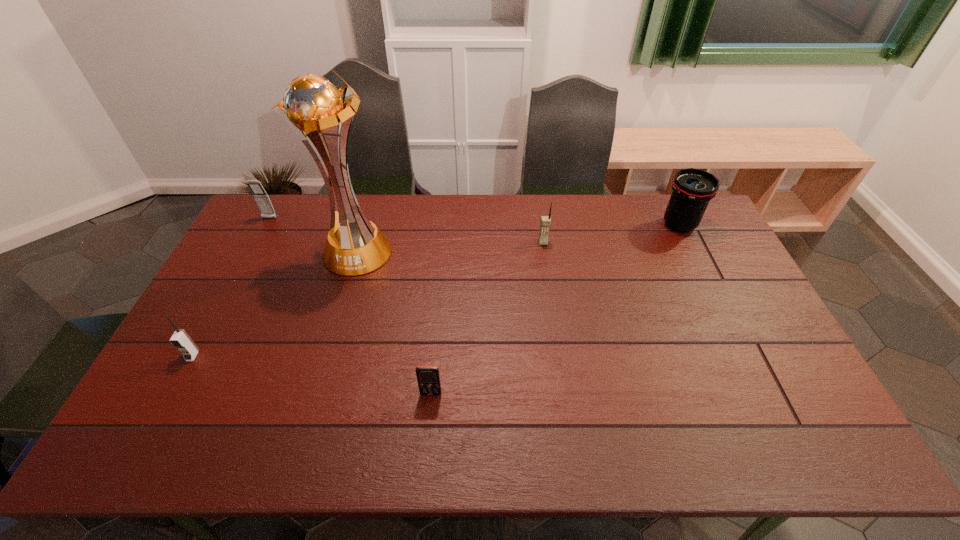
Select which cellular telephone is the closest to the rightmost object. Please provide its 2D coordinates. Your answer should be formatted as a tuple, i.e. [(x, y)], where the tuple contains the x and y coordinates of a point satisfying the conditions above.

[(545, 222)]

Locate which cellular telephone ranks third in proximity to the fifth object from left to right. Please provide its 2D coordinates. Your answer should be formatted as a tuple, i.e. [(x, y)], where the tuple contains the x and y coordinates of a point satisfying the conditions above.

[(180, 339)]

What are the coordinates of `free space that satisfies the following two spatial constraints: 1. on the front-facing side of the rightmost object; 2. on the left side of the farthest cellular telephone` in the screenshot? It's located at (266, 225).